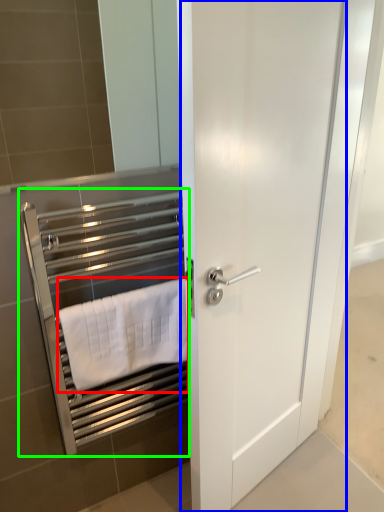
Question: Estimate the real-world distances between objects in this image. Which object is farther from towel (highlighted by a red box), door (highlighted by a blue box) or closet (highlighted by a green box)?

Choices:
 (A) door
 (B) closet

Answer: (A)